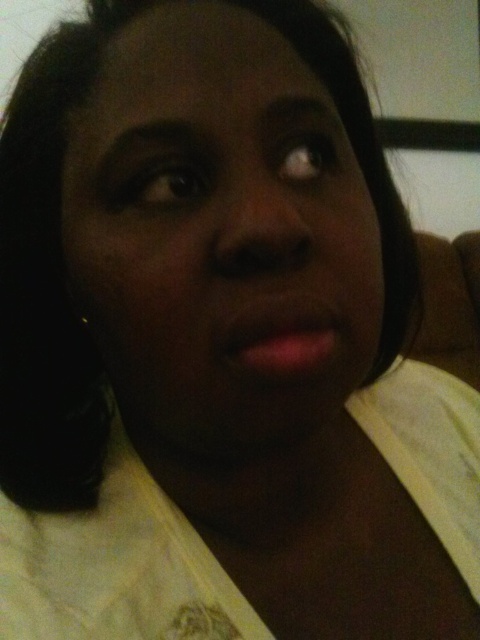
Question: Which point is farther to the camera?

Choices:
 (A) (252, 180)
 (B) (319, 339)

Answer: (A)

Question: Can you confirm if matte skin face at center is positioned to the right of matte pink lips at center?

Choices:
 (A) yes
 (B) no

Answer: (B)

Question: Does matte skin face at center appear on the left side of matte pink lips at center?

Choices:
 (A) yes
 (B) no

Answer: (A)

Question: Can you confirm if matte skin face at center is positioned to the left of matte pink lips at center?

Choices:
 (A) yes
 (B) no

Answer: (A)

Question: Which of the following is the farthest from the observer?

Choices:
 (A) matte pink lips at center
 (B) matte skin face at center

Answer: (A)

Question: Which point is farther to the camera?

Choices:
 (A) (186, 120)
 (B) (268, 328)

Answer: (A)